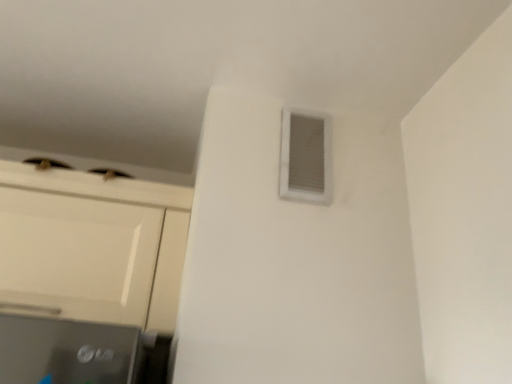
Describe the element at coordinates (306, 158) in the screenshot. Image resolution: width=512 pixels, height=384 pixels. I see `white plastic air conditioning at upper right` at that location.

Identify the location of white plastic air conditioning at upper right. (306, 158).

Locate an element on the screen. white plastic air conditioning at upper right is located at coordinates (306, 158).